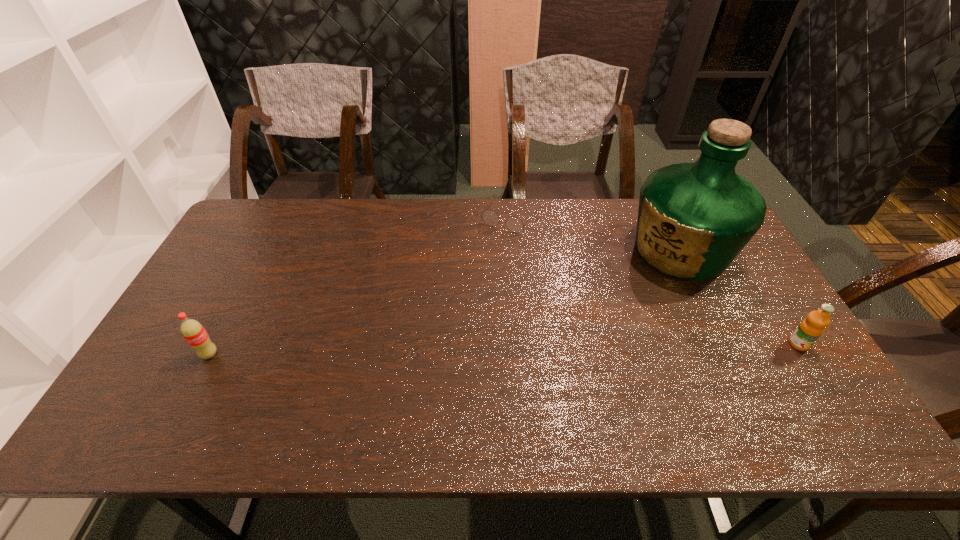
Where is `vacant space located 0.260m on the label side of the liquor`? This screenshot has height=540, width=960. vacant space located 0.260m on the label side of the liquor is located at coordinates (587, 313).

Identify the location of free location located on the label side of the liquor. click(x=615, y=294).

Identify the location of free space located 0.090m on the label side of the liquor. Image resolution: width=960 pixels, height=540 pixels. (627, 286).

Locate an element on the screen. The height and width of the screenshot is (540, 960). spectacles at the far edge is located at coordinates (514, 224).

The width and height of the screenshot is (960, 540). I want to click on liquor that is at the far edge, so click(693, 220).

Where is `object that is at the left edge`? object that is at the left edge is located at coordinates (193, 332).

Where is `orange juice that is at the right edge`? The height and width of the screenshot is (540, 960). orange juice that is at the right edge is located at coordinates (810, 329).

This screenshot has height=540, width=960. Identify the location of liquor present at the right edge. (693, 220).

At what (x,y) coordinates should I click in order to perform the action: click on object that is at the far right corner. Please return your answer as a coordinate pair (x, y). The height and width of the screenshot is (540, 960). Looking at the image, I should click on (693, 220).

Where is `free region at the far edge of the desktop`? The image size is (960, 540). free region at the far edge of the desktop is located at coordinates (564, 212).